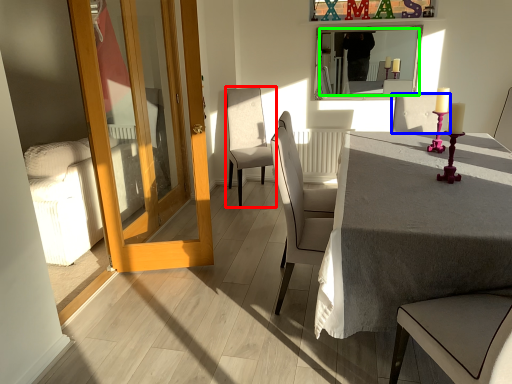
Question: Which object is the farthest from chair (highlighted by a red box)? Choose among these: chair (highlighted by a blue box) or mirror (highlighted by a green box).

Choices:
 (A) chair
 (B) mirror

Answer: (A)